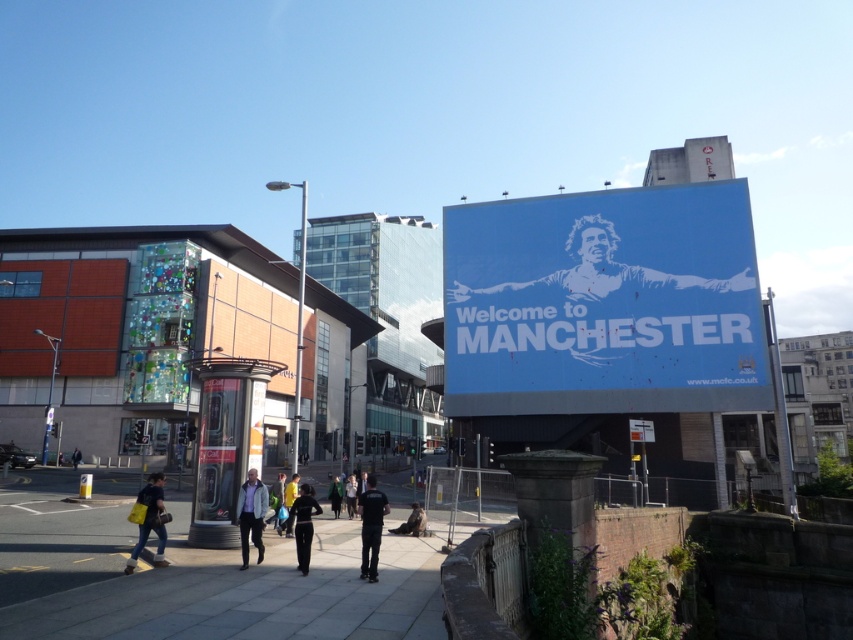
You are a tourist holding a map and looking at the blue matte signboard at upper center and the black uniform at center. Which object is bigger in size?

The blue matte signboard at upper center is larger in size than the black uniform at center.

You are a delivery drone flying over an urban area. You need to land on the smooth concrete pavement at center. What are the coordinates where you should aim to land?

The smooth concrete pavement at center is located at coordinates point (x=251, y=593), so you should aim for that point to land.